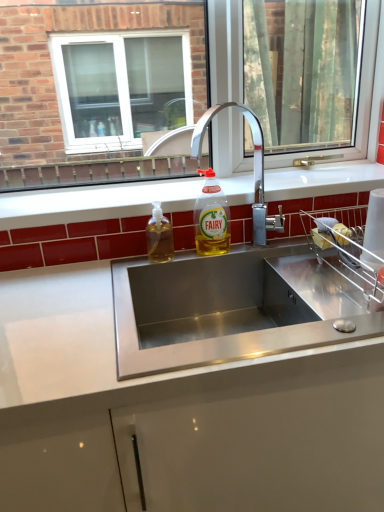
Question: Is translucent plastic soap dispenser at sink left, which appears as the 1th bottle when viewed from the left, thinner than yellow translucent liquid at sink center, which appears as the first bottle when viewed from the right?

Choices:
 (A) yes
 (B) no

Answer: (A)

Question: Does translucent plastic soap dispenser at sink left, which appears as the 1th bottle when viewed from the left, have a lesser height compared to yellow translucent liquid at sink center, which ranks as the 2th bottle in left-to-right order?

Choices:
 (A) no
 (B) yes

Answer: (B)

Question: Is translucent plastic soap dispenser at sink left, which appears as the 1th bottle when viewed from the left, next to yellow translucent liquid at sink center, which appears as the first bottle when viewed from the right?

Choices:
 (A) no
 (B) yes

Answer: (A)

Question: Considering the relative sizes of translucent plastic soap dispenser at sink left, the 2th bottle in the right-to-left sequence, and yellow translucent liquid at sink center, which ranks as the 2th bottle in left-to-right order, in the image provided, is translucent plastic soap dispenser at sink left, the 2th bottle in the right-to-left sequence, smaller than yellow translucent liquid at sink center, which ranks as the 2th bottle in left-to-right order,?

Choices:
 (A) yes
 (B) no

Answer: (A)

Question: From the image's perspective, would you say translucent plastic soap dispenser at sink left, which appears as the 1th bottle when viewed from the left, is shown under yellow translucent liquid at sink center, which ranks as the 2th bottle in left-to-right order?

Choices:
 (A) yes
 (B) no

Answer: (A)

Question: Does translucent plastic soap dispenser at sink left, the 2th bottle in the right-to-left sequence, have a larger size compared to yellow translucent liquid at sink center, which ranks as the 2th bottle in left-to-right order?

Choices:
 (A) yes
 (B) no

Answer: (B)

Question: Is stainless steel sink at center positioned far away from white glossy countertop at center?

Choices:
 (A) yes
 (B) no

Answer: (B)

Question: Is stainless steel sink at center shorter than white glossy countertop at center?

Choices:
 (A) no
 (B) yes

Answer: (B)

Question: From a real-world perspective, is stainless steel sink at center under white glossy countertop at center?

Choices:
 (A) yes
 (B) no

Answer: (B)

Question: Does stainless steel sink at center have a greater height compared to white glossy countertop at center?

Choices:
 (A) yes
 (B) no

Answer: (B)

Question: From the image's perspective, would you say stainless steel sink at center is shown under white glossy countertop at center?

Choices:
 (A) no
 (B) yes

Answer: (A)

Question: Does stainless steel sink at center have a larger size compared to white glossy countertop at center?

Choices:
 (A) no
 (B) yes

Answer: (A)

Question: Can you confirm if chrome metallic faucet at center is wider than clear glass window at center?

Choices:
 (A) yes
 (B) no

Answer: (A)